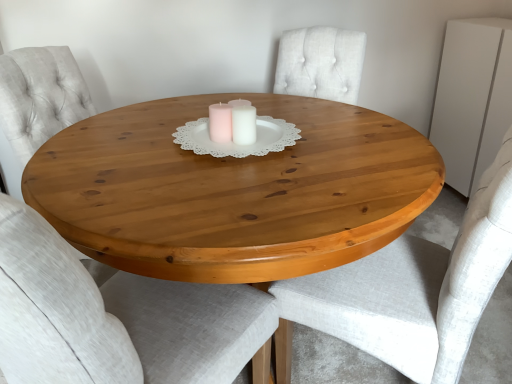
Where is `vacant space to the left of white matte candle at center`? This screenshot has width=512, height=384. vacant space to the left of white matte candle at center is located at coordinates (161, 139).